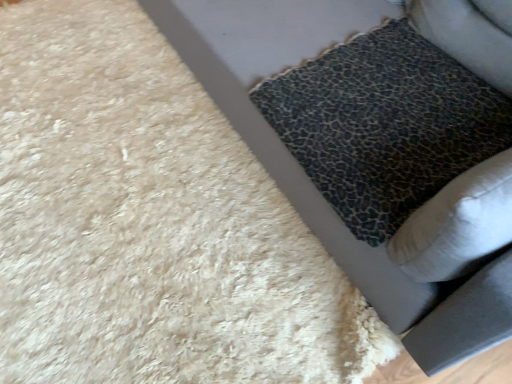
Question: In terms of height, does leather-textured cushion at lower right look taller or shorter compared to leopard print cushion at lower right?

Choices:
 (A) short
 (B) tall

Answer: (B)

Question: Considering the positions of leather-textured cushion at lower right and leopard print cushion at lower right in the image, is leather-textured cushion at lower right wider or thinner than leopard print cushion at lower right?

Choices:
 (A) wide
 (B) thin

Answer: (A)

Question: Choose the correct answer: Is leather-textured cushion at lower right inside leopard print cushion at lower right or outside it?

Choices:
 (A) inside
 (B) outside

Answer: (B)

Question: Relative to leather-textured cushion at lower right, is leopard print cushion at lower right in front or behind?

Choices:
 (A) behind
 (B) front

Answer: (A)

Question: From the image's perspective, is leopard print cushion at lower right located above or below leather-textured cushion at lower right?

Choices:
 (A) below
 (B) above

Answer: (A)

Question: Is leopard print cushion at lower right bigger or smaller than leather-textured cushion at lower right?

Choices:
 (A) big
 (B) small

Answer: (B)

Question: From their relative heights in the image, would you say leopard print cushion at lower right is taller or shorter than leather-textured cushion at lower right?

Choices:
 (A) short
 (B) tall

Answer: (A)